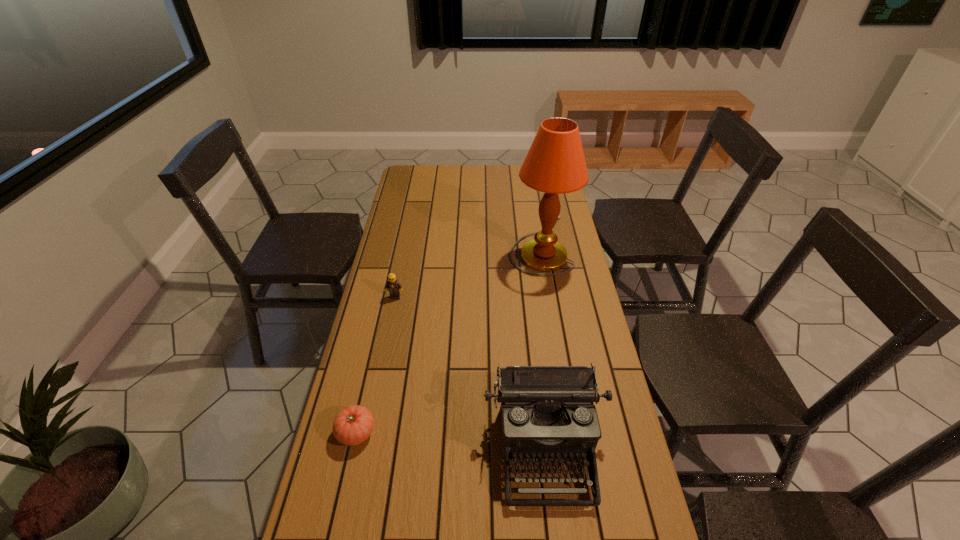
Where is `the farthest object`? The height and width of the screenshot is (540, 960). the farthest object is located at coordinates (555, 163).

Image resolution: width=960 pixels, height=540 pixels. In order to click on the tallest object in this screenshot , I will do `click(555, 163)`.

The width and height of the screenshot is (960, 540). Find the location of `typewriter`. typewriter is located at coordinates (547, 411).

Locate an element on the screen. the third tallest object is located at coordinates (393, 286).

Find the location of a particular element. Lego is located at coordinates (393, 286).

Locate an element on the screen. The height and width of the screenshot is (540, 960). tomato is located at coordinates (354, 424).

At what (x,y) coordinates should I click in order to perform the action: click on free space located on the back of the lamp. Please return your answer as a coordinate pair (x, y). Looking at the image, I should click on (531, 186).

Locate an element on the screen. The image size is (960, 540). vacant area situated in front of the third tallest object is located at coordinates (385, 349).

Locate an element on the screen. This screenshot has height=540, width=960. vacant space located 0.140m on the back of the shortest object is located at coordinates (370, 372).

Find the location of `Lego that is at the left edge`. Lego that is at the left edge is located at coordinates (393, 286).